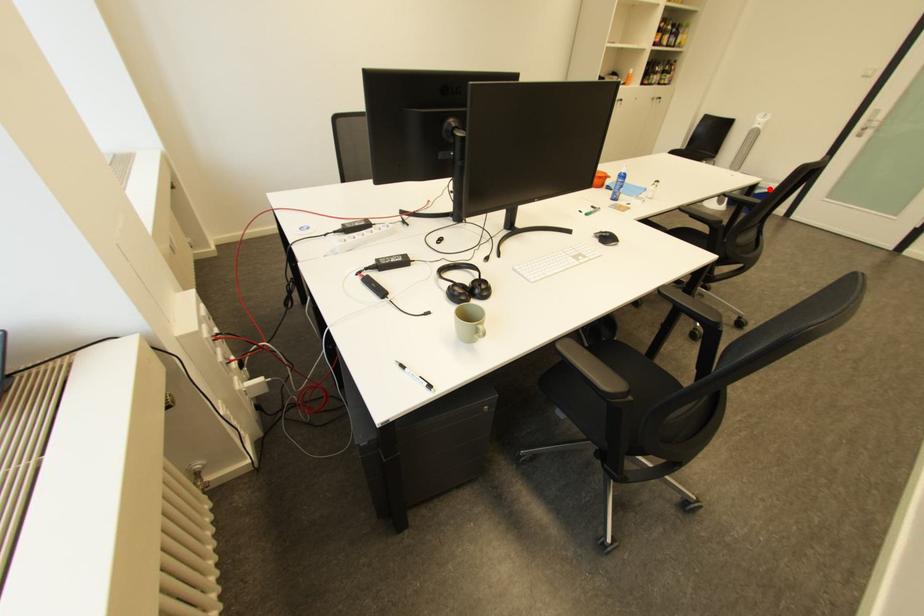
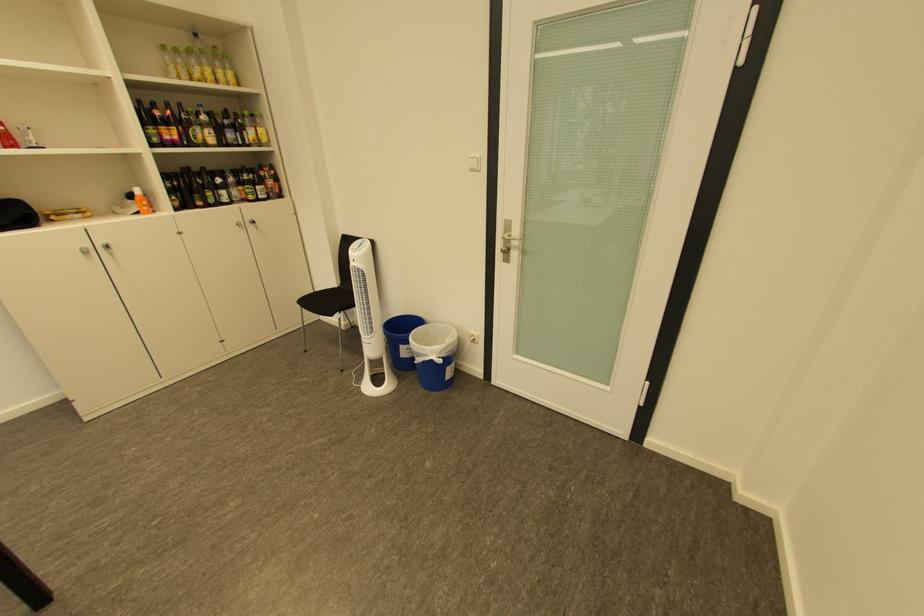
In the second image, find the point that corresponds to the highlighted location in the first image.

(429, 355)